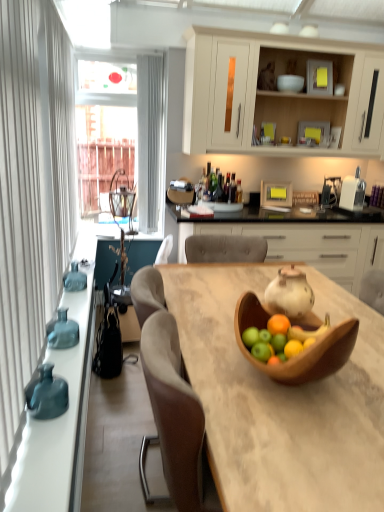
Where is `free spot in front of matte blue vase at left, the third vase viewed from the back`? free spot in front of matte blue vase at left, the third vase viewed from the back is located at coordinates (46, 438).